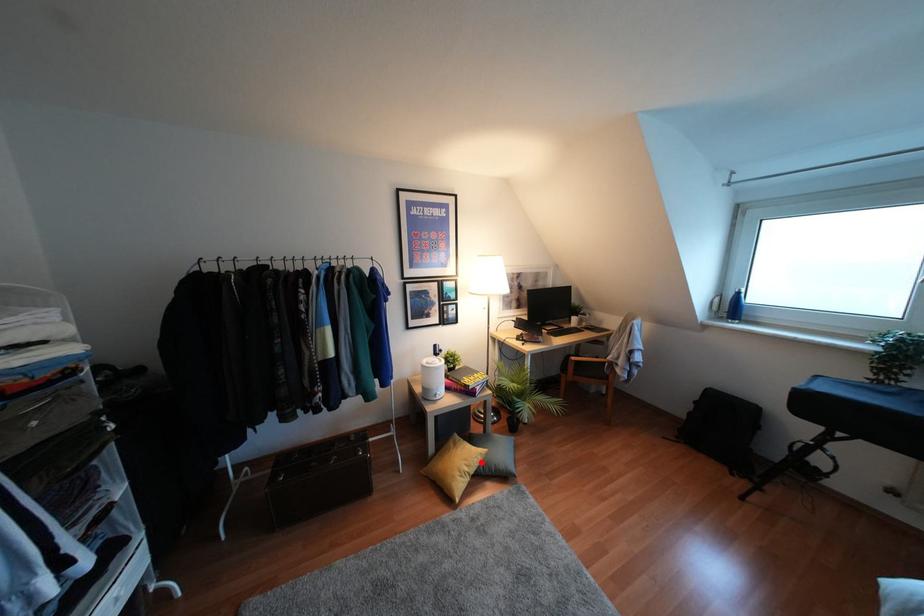
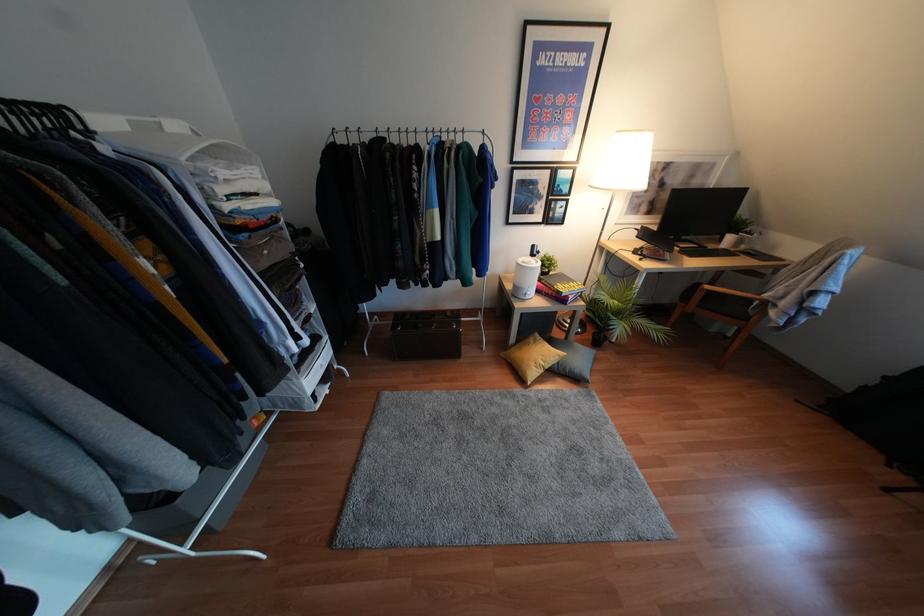
Question: I am providing you with two images of the same scene from different viewpoints. Image1 has a red point marked. In image2, the corresponding 3D location appears at what relative position? Reply with the corresponding letter.

Choices:
 (A) Closer
 (B) Farther

Answer: (B)